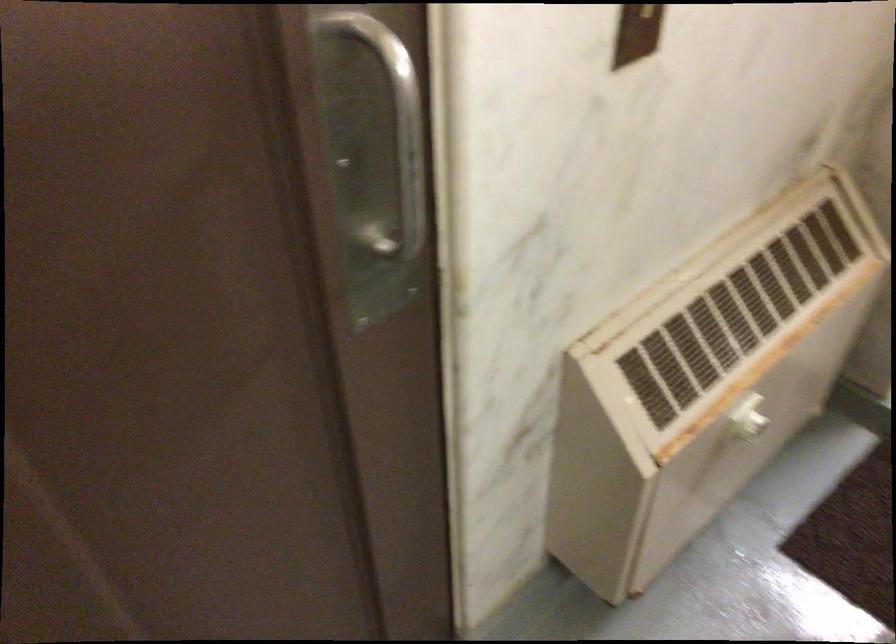
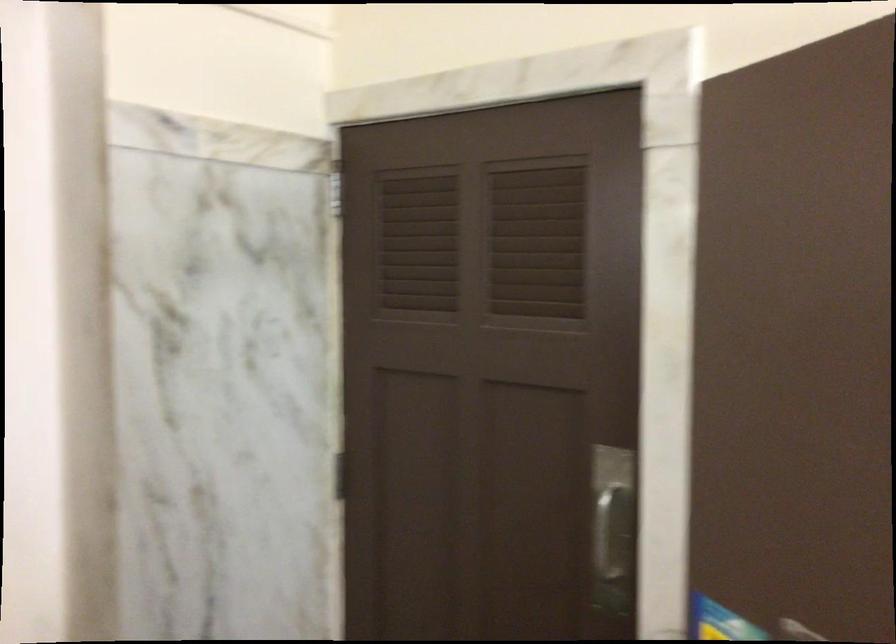
Where in the second image is the point corresponding to [367,201] from the first image?

(612, 543)